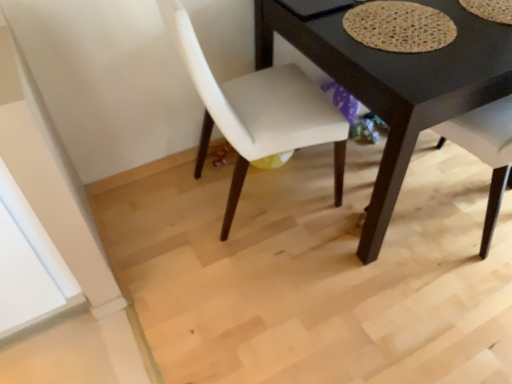
Locate an element on the screen. empty space that is to the right of textured beige mat at upper right is located at coordinates (476, 27).